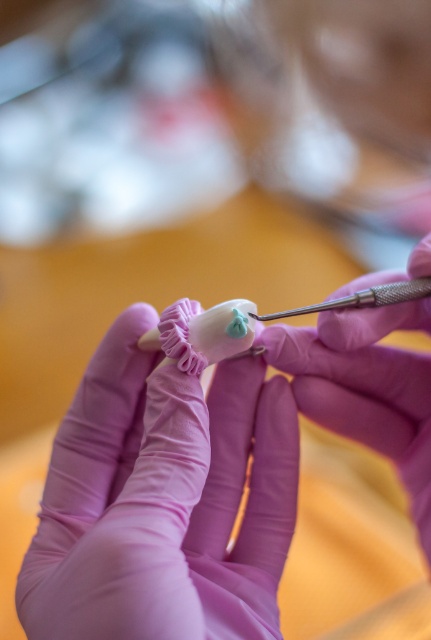
You are an apprentice craftsman observing the hands in the image. The matte pink glove at center is holding a delicate object, and the metallic needle at center is being used to adjust a small detail. Based on their positions, which object is closer to the bottom edge of the image?

The matte pink glove at center is below the metallic needle at center, so the matte pink glove at center is closer to the bottom edge of the image.